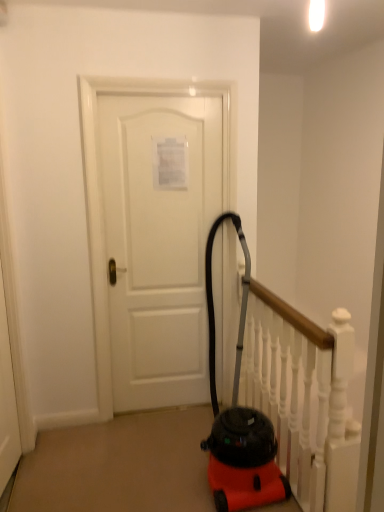
Image resolution: width=384 pixels, height=512 pixels. What are the coordinates of `free point to the left of white wooden rail at center` in the screenshot? It's located at (112, 471).